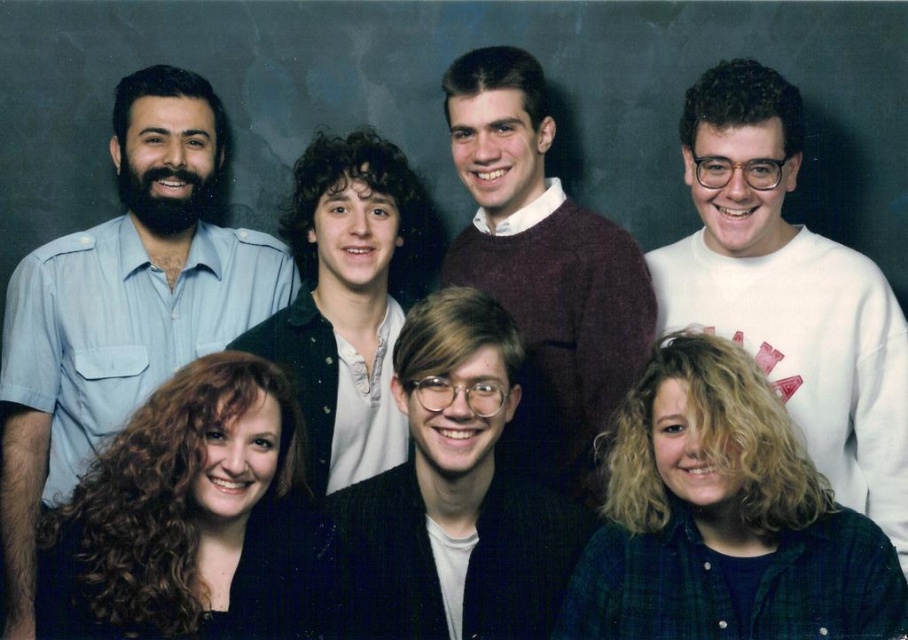
You are a photographer adjusting the lighting for a group photo. You notice the white cotton sweatshirt at upper right and the dark brown textured blazer at center. Which clothing item is placed higher in the image?

The white cotton sweatshirt at upper right is positioned over the dark brown textured blazer at center, meaning it is higher in the image.